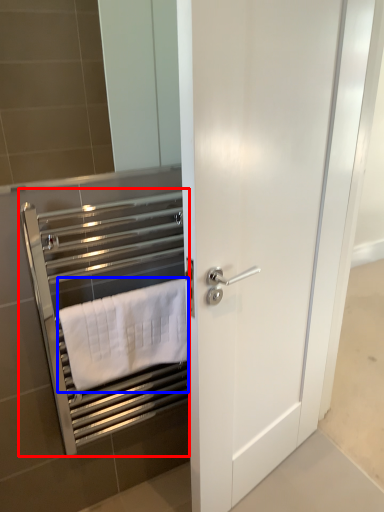
Question: Which object appears farthest to the camera in this image, closet (highlighted by a red box) or towel (highlighted by a blue box)?

Choices:
 (A) closet
 (B) towel

Answer: (B)